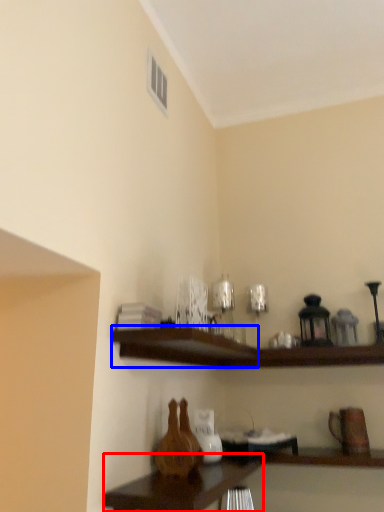
Question: Which of the following is the farthest to the observer, table (highlighted by a red box) or shelf (highlighted by a blue box)?

Choices:
 (A) table
 (B) shelf

Answer: (B)